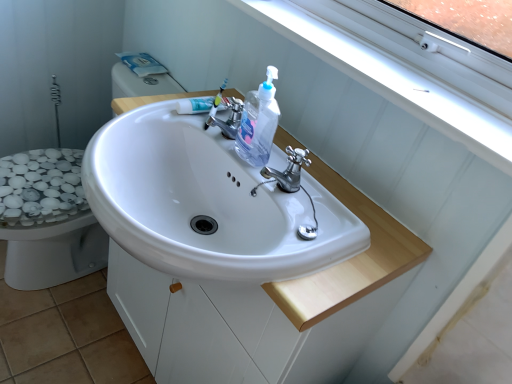
Question: From the image's perspective, does polished chrome faucet at center, which ranks as the 1th tap in right-to-left order, appear lower than white glossy sink at center?

Choices:
 (A) no
 (B) yes

Answer: (A)

Question: Is polished chrome faucet at center, the 1th tap when ordered from front to back, not inside white glossy sink at center?

Choices:
 (A) yes
 (B) no

Answer: (A)

Question: Is polished chrome faucet at center, positioned as the 1th tap in bottom-to-top order, oriented towards white glossy sink at center?

Choices:
 (A) no
 (B) yes

Answer: (A)

Question: From a real-world perspective, does polished chrome faucet at center, which is the 2th tap in left-to-right order, stand above white glossy sink at center?

Choices:
 (A) yes
 (B) no

Answer: (A)

Question: Is the surface of polished chrome faucet at center, which is the 2th tap in left-to-right order, in direct contact with white glossy sink at center?

Choices:
 (A) no
 (B) yes

Answer: (A)

Question: From the image's perspective, is white glossy bidet at lower left positioned above or below white glossy sink at center?

Choices:
 (A) below
 (B) above

Answer: (B)

Question: Would you say white glossy bidet at lower left is to the left or to the right of white glossy sink at center in the picture?

Choices:
 (A) right
 (B) left

Answer: (B)

Question: Is white glossy bidet at lower left taller or shorter than white glossy sink at center?

Choices:
 (A) short
 (B) tall

Answer: (B)

Question: Is point (53, 162) closer or farther from the camera than point (117, 129)?

Choices:
 (A) closer
 (B) farther

Answer: (B)

Question: Considering the positions of point (233, 102) and point (76, 178), is point (233, 102) closer or farther from the camera than point (76, 178)?

Choices:
 (A) farther
 (B) closer

Answer: (B)

Question: Considering the positions of chrome metallic faucet at center, which appears as the 2th tap when viewed from the front, and white glossy bidet at lower left in the image, is chrome metallic faucet at center, which appears as the 2th tap when viewed from the front, taller or shorter than white glossy bidet at lower left?

Choices:
 (A) short
 (B) tall

Answer: (A)

Question: Do you think chrome metallic faucet at center, the 1th tap when ordered from top to bottom, is within white glossy bidet at lower left, or outside of it?

Choices:
 (A) outside
 (B) inside

Answer: (A)

Question: In the image, is chrome metallic faucet at center, the 1th tap when ordered from top to bottom, on the left side or the right side of white glossy bidet at lower left?

Choices:
 (A) right
 (B) left

Answer: (A)

Question: Is point (262, 135) closer or farther from the camera than point (212, 119)?

Choices:
 (A) closer
 (B) farther

Answer: (A)

Question: From a real-world perspective, is clear plastic bottle at center physically located above or below chrome metallic faucet at center, positioned as the second tap in bottom-to-top order?

Choices:
 (A) above
 (B) below

Answer: (A)